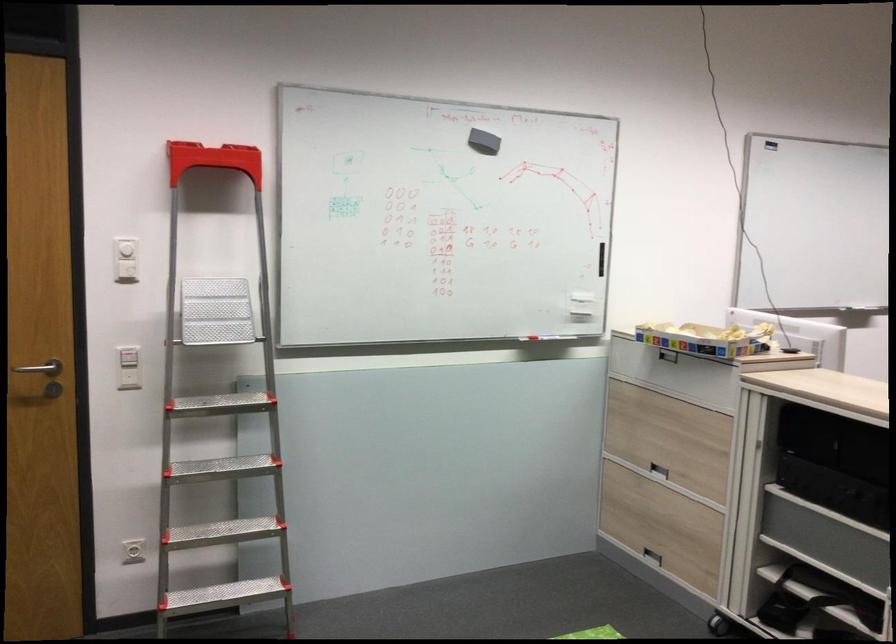
The image size is (896, 644). What do you see at coordinates (40, 368) in the screenshot? I see `the silver door handle` at bounding box center [40, 368].